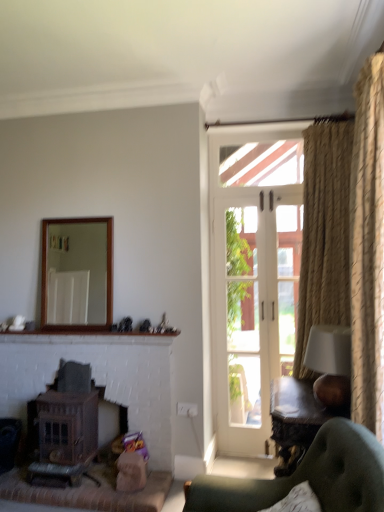
This screenshot has height=512, width=384. What do you see at coordinates (100, 378) in the screenshot?
I see `wooden fireplace at lower left, which ranks as the second fireplace in left-to-right order` at bounding box center [100, 378].

This screenshot has height=512, width=384. Find the location of `beige textured curtain at right`. beige textured curtain at right is located at coordinates (348, 240).

At what (x,y) coordinates should I click in order to perform the action: click on wooden frame mirror at upper center. Please return your answer as a coordinate pair (x, y). The width and height of the screenshot is (384, 512). Looking at the image, I should click on click(84, 261).

Describe the element at coordinates (66, 426) in the screenshot. I see `wooden fireplace at lower left, marked as the second fireplace in a right-to-left arrangement` at that location.

Where is `wooden polished table at lower right`? The height and width of the screenshot is (512, 384). wooden polished table at lower right is located at coordinates (296, 420).

Where is `green tufted chair at lower right`? green tufted chair at lower right is located at coordinates (306, 477).

Can you tell me how much white glass screen door at center and wooden fireplace at lower left, arranged as the 1th fireplace when viewed from the left, differ in facing direction?

white glass screen door at center and wooden fireplace at lower left, arranged as the 1th fireplace when viewed from the left, are facing 1.56 degrees away from each other.

Is white glass screen door at center to the right of wooden fireplace at lower left, marked as the second fireplace in a right-to-left arrangement, from the viewer's perspective?

Correct, you'll find white glass screen door at center to the right of wooden fireplace at lower left, marked as the second fireplace in a right-to-left arrangement.

Is white glass screen door at center far away from wooden fireplace at lower left, marked as the second fireplace in a right-to-left arrangement?

Indeed, white glass screen door at center is not near wooden fireplace at lower left, marked as the second fireplace in a right-to-left arrangement.

Does white brick mantle at center have a greater width compared to white glass screen door at center?

Correct, the width of white brick mantle at center exceeds that of white glass screen door at center.

Is white brick mantle at center taller or shorter than white glass screen door at center?

Considering their sizes, white brick mantle at center has less height than white glass screen door at center.

Considering the positions of points (66, 338) and (244, 271), is point (66, 338) farther from camera compared to point (244, 271)?

No, (66, 338) is in front of (244, 271).

Between white brick mantle at center and white glass screen door at center, which one is positioned in front?

Positioned in front is white brick mantle at center.

The image size is (384, 512). Find the location of `fireplace that appears on the right of wooden frame mirror at upper center`. fireplace that appears on the right of wooden frame mirror at upper center is located at coordinates (100, 378).

Is there a large distance between wooden frame mirror at upper center and wooden fireplace at lower left, which ranks as the second fireplace in left-to-right order?

No.

Consider the image. Considering the sizes of objects wooden frame mirror at upper center and wooden fireplace at lower left, which ranks as the second fireplace in left-to-right order, in the image provided, who is bigger, wooden frame mirror at upper center or wooden fireplace at lower left, which ranks as the second fireplace in left-to-right order,?

wooden fireplace at lower left, which ranks as the second fireplace in left-to-right order.

Is wooden fireplace at lower left, the 1th fireplace when ordered from right to left, a part of wooden frame mirror at upper center?

No, wooden frame mirror at upper center does not contain wooden fireplace at lower left, the 1th fireplace when ordered from right to left.

Is beige textured curtain at right wider than wooden polished table at lower right?

Incorrect, the width of beige textured curtain at right does not surpass that of wooden polished table at lower right.

Is beige textured curtain at right outside of wooden polished table at lower right?

Indeed, beige textured curtain at right is completely outside wooden polished table at lower right.

From a real-world perspective, is beige textured curtain at right on wooden polished table at lower right?

Yes.

From the image's perspective, relative to wooden polished table at lower right, is beige textured curtain at right above or below?

beige textured curtain at right is above wooden polished table at lower right.

Where is `mantle below the wooden frame mirror at upper center (from the image's perspective)`? This screenshot has width=384, height=512. mantle below the wooden frame mirror at upper center (from the image's perspective) is located at coordinates (88, 337).

Based on their sizes in the image, would you say wooden frame mirror at upper center is bigger or smaller than white brick mantle at center?

wooden frame mirror at upper center is bigger than white brick mantle at center.

Which is more to the left, beige textured curtain at right or wooden fireplace at lower left, which ranks as the second fireplace in left-to-right order?

wooden fireplace at lower left, which ranks as the second fireplace in left-to-right order, is more to the left.

Is beige textured curtain at right situated inside wooden fireplace at lower left, the 1th fireplace when ordered from right to left, or outside?

beige textured curtain at right is not inside wooden fireplace at lower left, the 1th fireplace when ordered from right to left, it's outside.

From a real-world perspective, between beige textured curtain at right and wooden fireplace at lower left, which ranks as the second fireplace in left-to-right order, who is vertically higher?

beige textured curtain at right.

Looking at their sizes, would you say beige textured curtain at right is wider or thinner than wooden fireplace at lower left, which ranks as the second fireplace in left-to-right order?

In the image, beige textured curtain at right appears to be wider than wooden fireplace at lower left, which ranks as the second fireplace in left-to-right order.

Choose the correct answer: Is wooden fireplace at lower left, marked as the second fireplace in a right-to-left arrangement, inside green tufted chair at lower right or outside it?

The correct answer is: outside.

From a real-world perspective, is wooden fireplace at lower left, arranged as the 1th fireplace when viewed from the left, on top of green tufted chair at lower right?

Incorrect, from a real-world perspective, wooden fireplace at lower left, arranged as the 1th fireplace when viewed from the left, is lower than green tufted chair at lower right.

Is wooden fireplace at lower left, marked as the second fireplace in a right-to-left arrangement, turned away from green tufted chair at lower right?

No, wooden fireplace at lower left, marked as the second fireplace in a right-to-left arrangement,'s orientation is not away from green tufted chair at lower right.

The image size is (384, 512). I want to click on fireplace that is the 2nd object directly below the white glass screen door at center (from a real-world perspective), so click(x=66, y=426).

Find the location of a particular element. screen door that is above the white brick mantle at center (from a real-world perspective) is located at coordinates (246, 324).

When comparing their distances from green tufted chair at lower right, does wooden fireplace at lower left, arranged as the 1th fireplace when viewed from the left, or white brick mantle at center seem further?

wooden fireplace at lower left, arranged as the 1th fireplace when viewed from the left, is positioned further to the anchor green tufted chair at lower right.

Based on their spatial positions, is wooden fireplace at lower left, which ranks as the second fireplace in left-to-right order, or white fabric lampshade at right closer to wooden fireplace at lower left, marked as the second fireplace in a right-to-left arrangement?

Based on the image, wooden fireplace at lower left, which ranks as the second fireplace in left-to-right order, appears to be nearer to wooden fireplace at lower left, marked as the second fireplace in a right-to-left arrangement.

Based on their spatial positions, is green tufted chair at lower right or beige textured curtain at right further from white glass screen door at center?

Based on the image, green tufted chair at lower right appears to be further to white glass screen door at center.

Looking at this image, based on their spatial positions, is wooden polished table at lower right or white fabric lampshade at right closer to beige textured curtain at right?

white fabric lampshade at right is closer to beige textured curtain at right.

Considering their positions, is wooden frame mirror at upper center positioned further to white brick mantle at center than beige textured curtain at right?

beige textured curtain at right.

Estimate the real-world distances between objects in this image. Which object is further from wooden frame mirror at upper center, beige textured curtain at right or white glass screen door at center?

beige textured curtain at right lies further to wooden frame mirror at upper center than the other object.

Estimate the real-world distances between objects in this image. Which object is closer to wooden fireplace at lower left, which ranks as the second fireplace in left-to-right order, white fabric lampshade at right or white brick mantle at center?

white brick mantle at center is positioned closer to the anchor wooden fireplace at lower left, which ranks as the second fireplace in left-to-right order.

In the scene shown: From the image, which object appears to be farther from white glass screen door at center, white brick mantle at center or wooden frame mirror at upper center?

wooden frame mirror at upper center lies further to white glass screen door at center than the other object.

Identify the location of lamp between green tufted chair at lower right and wooden frame mirror at upper center from front to back. (330, 364).

I want to click on mantle between wooden frame mirror at upper center and beige textured curtain at right from left to right, so click(x=88, y=337).

Where is `chair between wooden fireplace at lower left, the 1th fireplace when ordered from right to left, and white fabric lampshade at right from left to right`? The height and width of the screenshot is (512, 384). chair between wooden fireplace at lower left, the 1th fireplace when ordered from right to left, and white fabric lampshade at right from left to right is located at coordinates (306, 477).

The width and height of the screenshot is (384, 512). What are the coordinates of `lamp between wooden polished table at lower right and white glass screen door at center in the front-back direction` in the screenshot? It's located at (x=330, y=364).